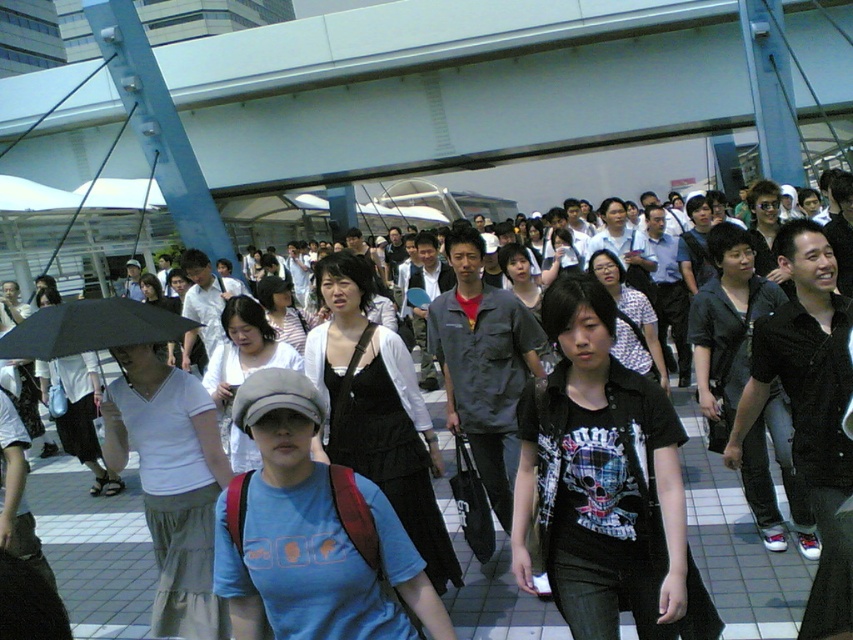
You are a delivery person carrying a package that is 4 meters long. You need to navigate through the crowd in the image to reach the exit. Is there enough space between the matte black dress at center and the black matte umbrella at left to pass through with your package?

The distance between the matte black dress at center and the black matte umbrella at left is 3.55 meters. Since your package is 4 meters long, it would not fit through the space available.

You are standing in the pedestrian area and want to locate the matte black dress at center. According to the coordinates provided, in which direction should you look relative to your current position?

You should look towards the bottom right direction since the coordinates point to the lower right area of the image.

You are a photographer trying to capture a clear shot of the matte black dress at center and the black matte umbrella at left. Since the dress is smaller than the umbrella, which object should you focus on first to ensure both are in frame?

The matte black dress at center is smaller than the black matte umbrella at left, so you should focus on the black matte umbrella at left first to ensure it fits within the frame before adjusting for the smaller dress.